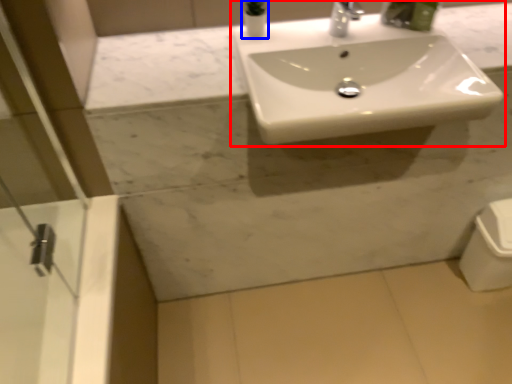
Question: Among these objects, which one is nearest to the camera, sink (highlighted by a red box) or toiletry (highlighted by a blue box)?

Choices:
 (A) sink
 (B) toiletry

Answer: (A)